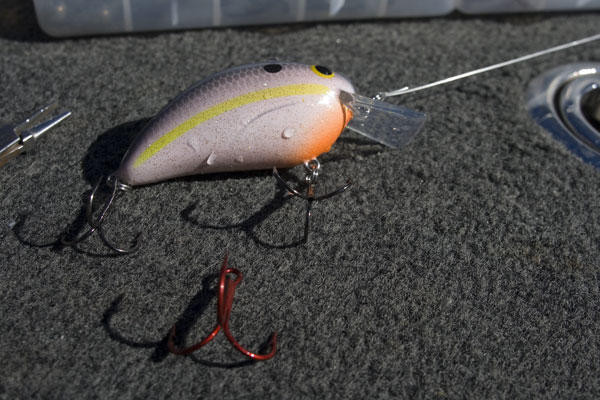
The width and height of the screenshot is (600, 400). Identify the location of plastic container. (169, 13).